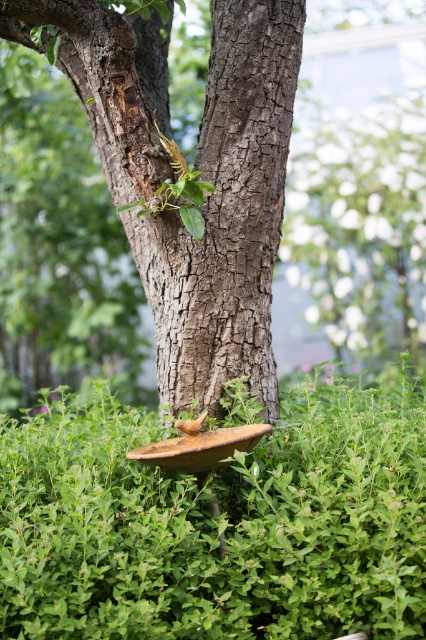
Consider the image. You are a gardener who wants to plant a new shrub that requires partial shade. You notice the green leafy hedge at lower center and the rough bark tree trunk at center. Which object provides more shade for the shrub?

The rough bark tree trunk at center is taller than the green leafy hedge at lower center, so it likely provides more shade for the shrub.

You are a gardener planning to plant a new flower bed between the green leafy hedge at lower center and the rough bark tree trunk at center. Which side of the tree trunk should you place the flowers to ensure they are between both objects?

The green leafy hedge at lower center is positioned on the right side of the rough bark tree trunk at center, so you should place the flowers to the right side of the rough bark tree trunk at center to keep them between the two objects.

You are a gardener who wants to prune the green leafy hedge at lower center and the rough bark tree trunk at center. Which object should you prune first if you want to start with the one closer to you?

The green leafy hedge at lower center should be pruned first because it is in front of the rough bark tree trunk at center, making it closer to you.